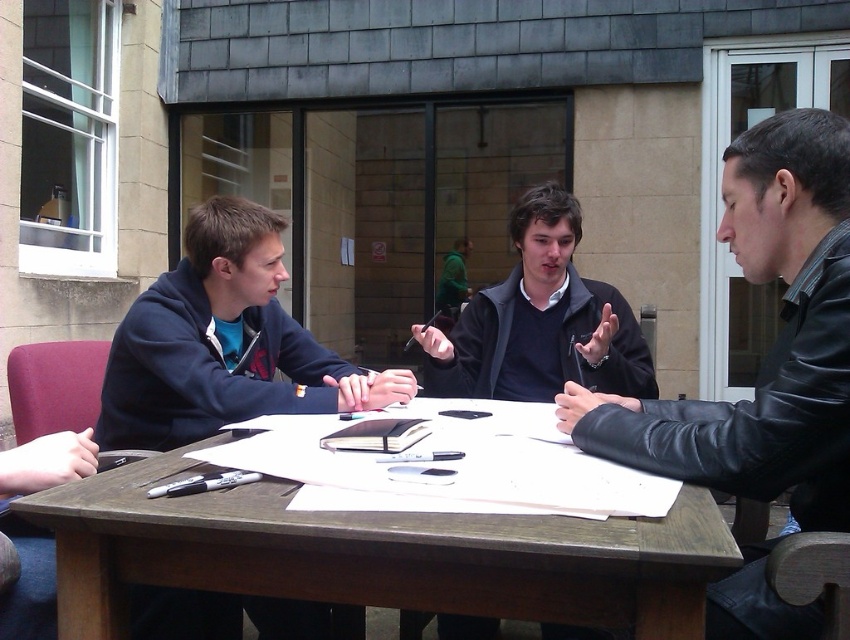
Is brown wooden table at center taller than black leather jacket at right?

Incorrect, brown wooden table at center's height is not larger of black leather jacket at right's.

Is brown wooden table at center positioned behind black leather jacket at right?

No, brown wooden table at center is in front of black leather jacket at right.

Measure the distance between brown wooden table at center and camera.

brown wooden table at center is 88.54 centimeters away from camera.

Locate an element on the screen. brown wooden table at center is located at coordinates (380, 556).